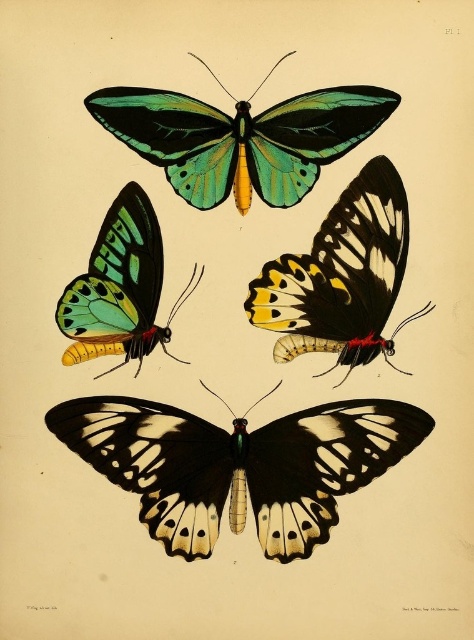
Question: Can you confirm if shiny green and black butterfly at upper center is thinner than shiny green and yellow butterfly at upper left?

Choices:
 (A) yes
 (B) no

Answer: (B)

Question: Which is farther from the black glossy butterfly at bottom?

Choices:
 (A) shiny green and black butterfly at upper center
 (B) green glossy butterfly at upper center
 (C) shiny green and yellow butterfly at upper left

Answer: (A)

Question: Estimate the real-world distances between objects in this image. Which object is farther from the shiny green and yellow butterfly at upper left?

Choices:
 (A) shiny green and black butterfly at upper center
 (B) green glossy butterfly at upper center

Answer: (B)

Question: Which of these objects is positioned farthest from the green glossy butterfly at upper center?

Choices:
 (A) shiny green and black butterfly at upper center
 (B) shiny green and yellow butterfly at upper left

Answer: (B)

Question: Is black glossy butterfly at bottom positioned in front of green glossy butterfly at upper center?

Choices:
 (A) yes
 (B) no

Answer: (A)

Question: Can you confirm if black glossy butterfly at bottom is positioned to the right of shiny green and black butterfly at upper center?

Choices:
 (A) yes
 (B) no

Answer: (B)